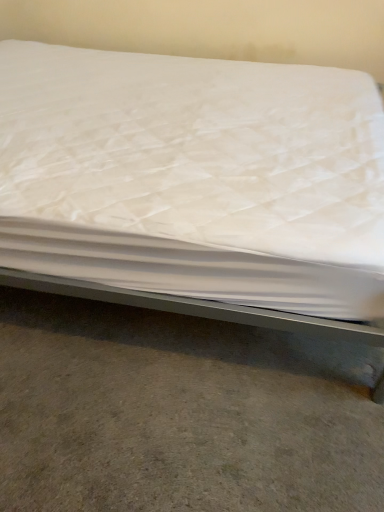
Question: Does white quilted mattress at center have a greater height compared to gray concrete floor at lower center?

Choices:
 (A) no
 (B) yes

Answer: (B)

Question: Considering the relative sizes of white quilted mattress at center and gray concrete floor at lower center in the image provided, is white quilted mattress at center shorter than gray concrete floor at lower center?

Choices:
 (A) yes
 (B) no

Answer: (B)

Question: Is white quilted mattress at center positioned with its back to gray concrete floor at lower center?

Choices:
 (A) no
 (B) yes

Answer: (A)

Question: Are white quilted mattress at center and gray concrete floor at lower center located far from each other?

Choices:
 (A) yes
 (B) no

Answer: (B)

Question: Is white quilted mattress at center thinner than gray concrete floor at lower center?

Choices:
 (A) yes
 (B) no

Answer: (B)

Question: Is white quilted mattress at center wider than gray concrete floor at lower center?

Choices:
 (A) no
 (B) yes

Answer: (B)

Question: Is gray concrete floor at lower center oriented away from white quilted mattress at center?

Choices:
 (A) no
 (B) yes

Answer: (A)

Question: From a real-world perspective, is gray concrete floor at lower center physically above white quilted mattress at center?

Choices:
 (A) no
 (B) yes

Answer: (A)

Question: Can you confirm if gray concrete floor at lower center is taller than white quilted mattress at center?

Choices:
 (A) yes
 (B) no

Answer: (B)

Question: Is white quilted mattress at center a part of gray concrete floor at lower center?

Choices:
 (A) yes
 (B) no

Answer: (B)

Question: Is gray concrete floor at lower center bigger than white quilted mattress at center?

Choices:
 (A) no
 (B) yes

Answer: (A)

Question: Considering the relative positions of gray concrete floor at lower center and white quilted mattress at center in the image provided, is gray concrete floor at lower center to the right of white quilted mattress at center from the viewer's perspective?

Choices:
 (A) no
 (B) yes

Answer: (B)

Question: Is gray concrete floor at lower center taller or shorter than white quilted mattress at center?

Choices:
 (A) short
 (B) tall

Answer: (A)